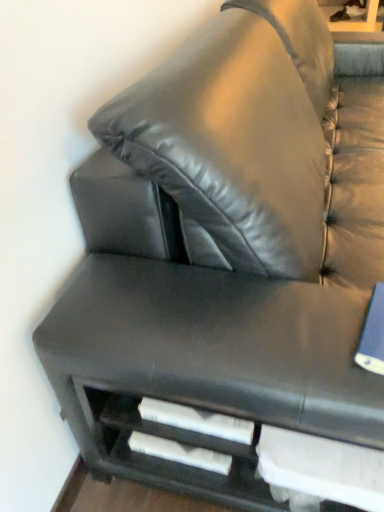
What do you see at coordinates (126, 497) in the screenshot? This screenshot has width=384, height=512. I see `black leather shelf at lower center` at bounding box center [126, 497].

You are a GUI agent. You are given a task and a screenshot of the screen. Output one action in this format:
    pyautogui.click(x=<x>, y=<y>)
    Task: Click on the black leather shelf at lower center
    This screenshot has width=384, height=512.
    Given the screenshot: What is the action you would take?
    (126, 497)

Find the location of a particular element. The image size is (384, 512). black leather shelf at lower center is located at coordinates (126, 497).